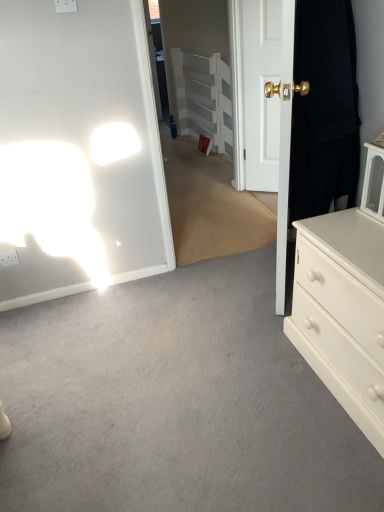
Locate an element on the screen. vacant area that is in front of white glossy door at center, arranged as the 2th door when viewed from the front is located at coordinates (263, 197).